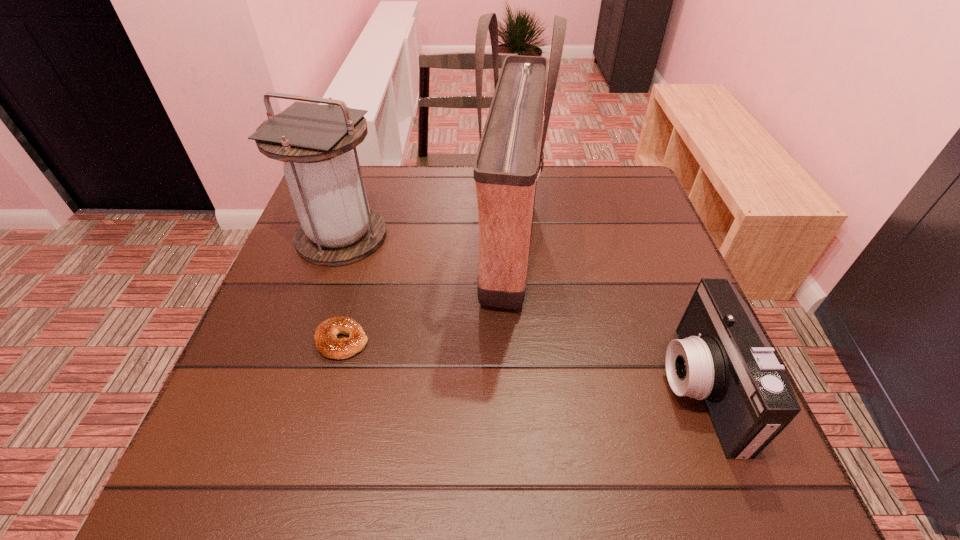
Locate an element on the screen. Image resolution: width=960 pixels, height=540 pixels. free space located 0.310m on the lens of the third tallest object is located at coordinates click(x=493, y=388).

Locate an element on the screen. The width and height of the screenshot is (960, 540). free space located 0.100m on the back of the bagel is located at coordinates (357, 286).

This screenshot has height=540, width=960. In order to click on shopping bag that is at the far edge in this screenshot , I will do click(x=506, y=164).

Identify the location of lantern that is at the far edge. This screenshot has width=960, height=540. (337, 227).

Identify the location of object present at the near edge. The width and height of the screenshot is (960, 540). (722, 357).

You are a GUI agent. You are given a task and a screenshot of the screen. Output one action in this format:
    pyautogui.click(x=<x>, y=<y>)
    Task: Click on the lantern located at the left edge
    This screenshot has width=960, height=540.
    Given the screenshot: What is the action you would take?
    pyautogui.click(x=337, y=227)

In order to click on bagel at the left edge in this screenshot , I will do `click(325, 336)`.

Image resolution: width=960 pixels, height=540 pixels. I want to click on object that is at the right edge, so click(722, 357).

This screenshot has width=960, height=540. In order to click on object located in the far left corner section of the desktop in this screenshot , I will do `click(337, 227)`.

This screenshot has width=960, height=540. I want to click on object present at the near right corner, so click(722, 357).